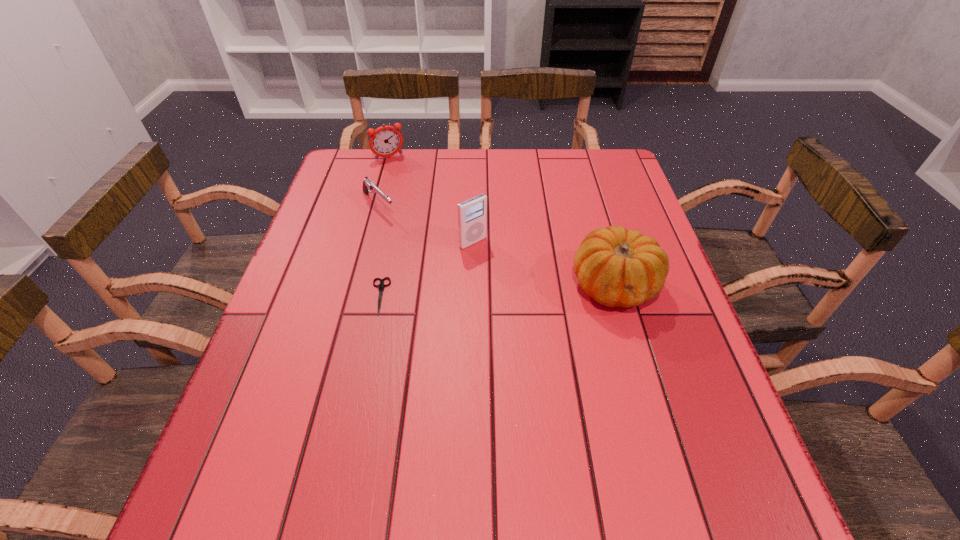
What are the coordinates of `shears` in the screenshot? It's located at (381, 286).

You are a GUI agent. You are given a task and a screenshot of the screen. Output one action in this format:
    pyautogui.click(x=<x>, y=<y>)
    Task: Click on the rightmost object
    
    Given the screenshot: What is the action you would take?
    pyautogui.click(x=616, y=267)

You are a GUI agent. You are given a task and a screenshot of the screen. Output one action in this format:
    pyautogui.click(x=<x>, y=<y>)
    Task: Click on the fourth tallest object
    Image resolution: width=960 pixels, height=540 pixels.
    Given the screenshot: What is the action you would take?
    pyautogui.click(x=368, y=186)

The height and width of the screenshot is (540, 960). What are the coordinates of `pistol` in the screenshot? It's located at (368, 186).

Image resolution: width=960 pixels, height=540 pixels. Find the location of `iPod`. iPod is located at coordinates (472, 214).

The height and width of the screenshot is (540, 960). In order to click on the fourth object from left to right in this screenshot , I will do `click(472, 214)`.

This screenshot has height=540, width=960. Find the location of `the farthest object`. the farthest object is located at coordinates (385, 141).

The height and width of the screenshot is (540, 960). Find the location of `free space located on the left of the shears`. free space located on the left of the shears is located at coordinates (326, 296).

Locate an element on the screen. free space located 0.240m on the back of the rightmost object is located at coordinates (589, 198).

Locate an element on the screen. This screenshot has width=960, height=540. free location located 0.300m on the front-facing side of the second farthest object is located at coordinates (452, 279).